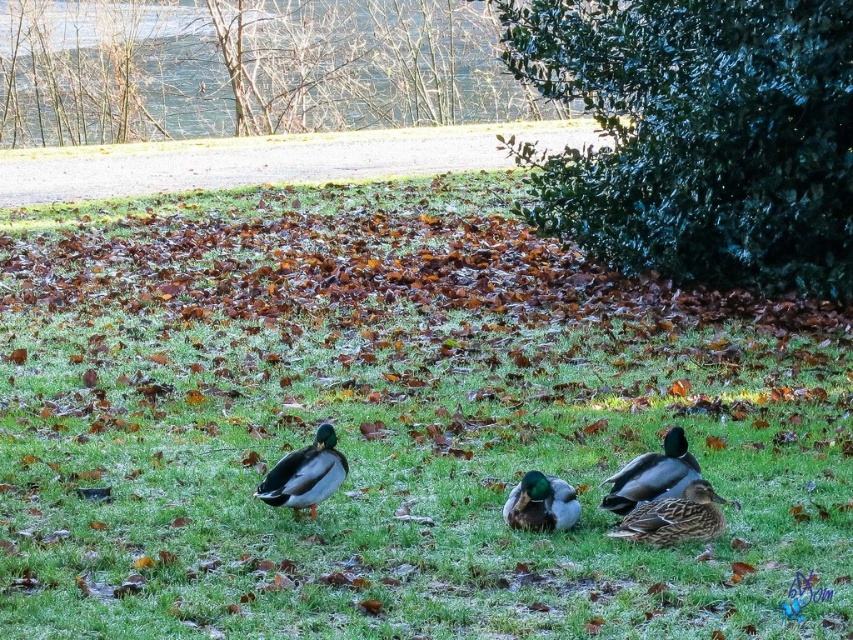
You are a photographer aiming to capture both the brown matte duck at lower right and the shiny brown duck at lower right in a single frame. Given their sizes, which duck will appear larger in your photo?

The shiny brown duck at lower right will appear larger in the photo because it is bigger in size compared to the brown matte duck at lower right.

You are a photographer trying to capture a closeup of the shiny brown duck at lower right without the green leafy bush at center blocking the view. Can you move closer to the duck to avoid the bush?

The green leafy bush at center is closer to you than the shiny brown duck at lower right, so moving closer to the duck might not help. You need to move around the bush to get a clear shot.

You are standing at the point labeled point (637, 499) and want to walk towards the point labeled point (695, 499). Which direction should you face to move towards it?

You should face upwards because point (695, 499) is closer to the viewer than point (637, 499).